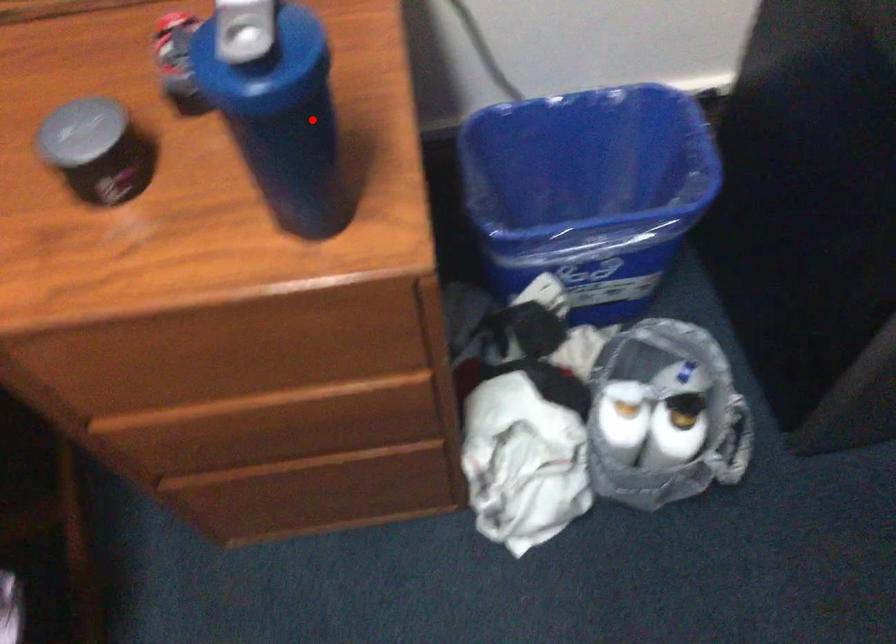
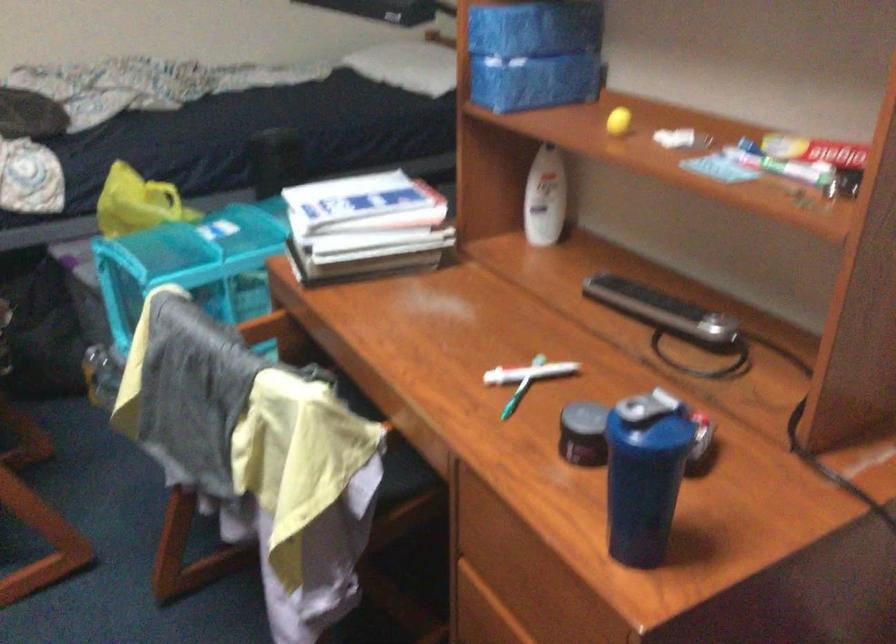
Question: I am providing you with two images of the same scene from different viewpoints. Given a red point in image1, look at the same physical point in image2. Is it:

Choices:
 (A) Closer to the viewpoint
 (B) Farther from the viewpoint

Answer: (B)